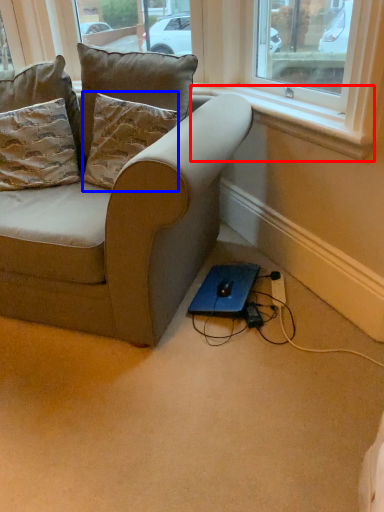
Question: Which object appears farthest to the camera in this image, window sill (highlighted by a red box) or pillow (highlighted by a blue box)?

Choices:
 (A) window sill
 (B) pillow

Answer: (B)